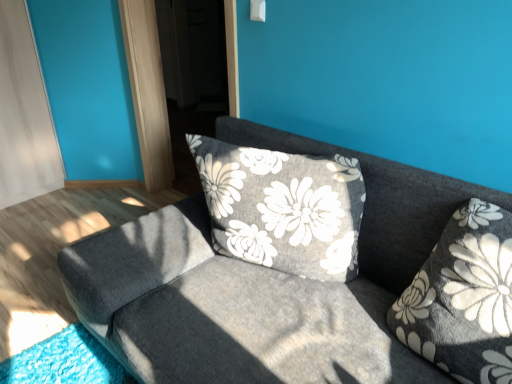
Question: Is textured gray couch at center looking in the opposite direction of fluffy gray pillow at right?

Choices:
 (A) yes
 (B) no

Answer: (A)

Question: From a real-world perspective, does textured gray couch at center stand above fluffy gray pillow at right?

Choices:
 (A) yes
 (B) no

Answer: (B)

Question: From a real-world perspective, is textured gray couch at center beneath fluffy gray pillow at right?

Choices:
 (A) yes
 (B) no

Answer: (A)

Question: Does textured gray couch at center have a greater width compared to fluffy gray pillow at right?

Choices:
 (A) yes
 (B) no

Answer: (A)

Question: Is textured gray couch at center not close to fluffy gray pillow at right?

Choices:
 (A) no
 (B) yes

Answer: (A)

Question: Is textured gray couch at center positioned before fluffy gray pillow at right?

Choices:
 (A) no
 (B) yes

Answer: (B)

Question: Considering the relative sizes of fluffy gray pillow at right and transparent glass screen door at upper center in the image provided, is fluffy gray pillow at right bigger than transparent glass screen door at upper center?

Choices:
 (A) yes
 (B) no

Answer: (B)

Question: Can transparent glass screen door at upper center be found inside fluffy gray pillow at right?

Choices:
 (A) no
 (B) yes

Answer: (A)

Question: Is the position of fluffy gray pillow at right less distant than that of transparent glass screen door at upper center?

Choices:
 (A) no
 (B) yes

Answer: (B)

Question: Is fluffy gray pillow at right thinner than transparent glass screen door at upper center?

Choices:
 (A) no
 (B) yes

Answer: (A)

Question: Is fluffy gray pillow at right in contact with transparent glass screen door at upper center?

Choices:
 (A) yes
 (B) no

Answer: (B)

Question: Considering the relative sizes of fluffy gray pillow at right and transparent glass screen door at upper center in the image provided, is fluffy gray pillow at right shorter than transparent glass screen door at upper center?

Choices:
 (A) no
 (B) yes

Answer: (B)

Question: Are textured gray couch at center and transparent glass screen door at upper center making contact?

Choices:
 (A) no
 (B) yes

Answer: (A)